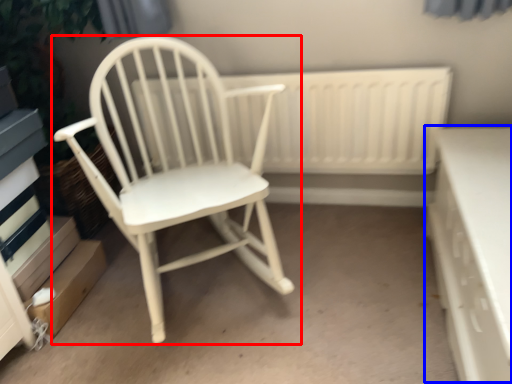
Question: Which of the following is the farthest to the observer, chair (highlighted by a red box) or table (highlighted by a blue box)?

Choices:
 (A) chair
 (B) table

Answer: (A)